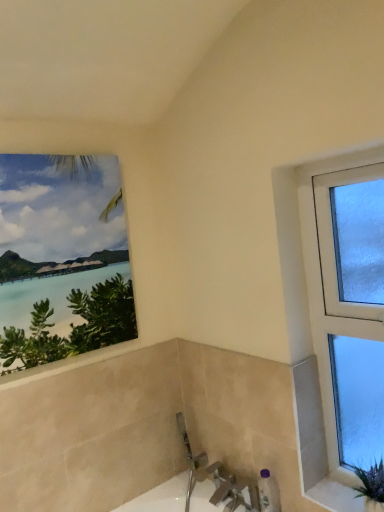
The image size is (384, 512). What do you see at coordinates (62, 258) in the screenshot?
I see `matte canvas painting at upper left, which is the first window from left to right` at bounding box center [62, 258].

This screenshot has width=384, height=512. Describe the element at coordinates (268, 492) in the screenshot. I see `purple plastic bottle at lower right` at that location.

How much space does clear glass window at right, which appears as the first window when viewed from the right, occupy vertically?

clear glass window at right, which appears as the first window when viewed from the right, is 1.16 meters tall.

Describe the element at coordinates (322, 290) in the screenshot. I see `clear glass window at right, which appears as the first window when viewed from the right` at that location.

What do you see at coordinates (338, 492) in the screenshot? I see `white textured stone at lower right` at bounding box center [338, 492].

Where is `white textured stone at lower right`? The image size is (384, 512). white textured stone at lower right is located at coordinates (338, 492).

The image size is (384, 512). What are the coordinates of `matte canvas painting at upper left, which appears as the 2th window when viewed from the right` in the screenshot? It's located at (62, 258).

Considering the sizes of white glossy bath at lower center and white textured stone at lower right in the image, is white glossy bath at lower center bigger or smaller than white textured stone at lower right?

Clearly, white glossy bath at lower center is larger in size than white textured stone at lower right.

Does white glossy bath at lower center appear on the left side of white textured stone at lower right?

Yes.

Is white glossy bath at lower center far away from white textured stone at lower right?

No, white glossy bath at lower center is in close proximity to white textured stone at lower right.

Does point (217, 467) come in front of point (312, 495)?

No, (217, 467) is further to viewer.

Is purple plastic bottle at lower right looking in the opposite direction of clear glass window at right, which is the 2th window in left-to-right order?

No, purple plastic bottle at lower right is not facing away from clear glass window at right, which is the 2th window in left-to-right order.

From the image's perspective, would you say purple plastic bottle at lower right is positioned over clear glass window at right, which is the 2th window in left-to-right order?

No, from the image's perspective, purple plastic bottle at lower right is not on top of clear glass window at right, which is the 2th window in left-to-right order.

From a real-world perspective, does purple plastic bottle at lower right sit lower than clear glass window at right, which appears as the first window when viewed from the right?

Yes, from a real-world perspective, purple plastic bottle at lower right is beneath clear glass window at right, which appears as the first window when viewed from the right.

At what (x,y) coordinates should I click in order to perform the action: click on toiletry below the clear glass window at right, which appears as the first window when viewed from the right (from a real-world perspective). Please return your answer as a coordinate pair (x, y). This screenshot has width=384, height=512. Looking at the image, I should click on (268, 492).

Is white glossy bath at lower center positioned with its back to clear glass window at right, which is the 2th window in left-to-right order?

No, clear glass window at right, which is the 2th window in left-to-right order, is not at the back of white glossy bath at lower center.

Looking at their sizes, would you say white glossy bath at lower center is wider or thinner than clear glass window at right, which is the 2th window in left-to-right order?

Considering their sizes, white glossy bath at lower center looks broader than clear glass window at right, which is the 2th window in left-to-right order.

Can you confirm if white glossy bath at lower center is bigger than clear glass window at right, which is the 2th window in left-to-right order?

Correct, white glossy bath at lower center is larger in size than clear glass window at right, which is the 2th window in left-to-right order.

Is purple plastic bottle at lower right facing away from white glossy bath at lower center?

purple plastic bottle at lower right does not have its back to white glossy bath at lower center.

Is purple plastic bottle at lower right situated inside white glossy bath at lower center or outside?

purple plastic bottle at lower right lies outside white glossy bath at lower center.

Considering the sizes of objects purple plastic bottle at lower right and white glossy bath at lower center in the image provided, who is wider, purple plastic bottle at lower right or white glossy bath at lower center?

With larger width is white glossy bath at lower center.

Which object is positioned more to the left, matte canvas painting at upper left, which appears as the 2th window when viewed from the right, or white glossy bath at lower center?

Positioned to the left is matte canvas painting at upper left, which appears as the 2th window when viewed from the right.

Considering the sizes of objects matte canvas painting at upper left, which is the first window from left to right, and white glossy bath at lower center in the image provided, who is bigger, matte canvas painting at upper left, which is the first window from left to right, or white glossy bath at lower center?

white glossy bath at lower center.

How many degrees apart are the facing directions of matte canvas painting at upper left, which is the first window from left to right, and white glossy bath at lower center?

matte canvas painting at upper left, which is the first window from left to right, and white glossy bath at lower center are facing 90 degrees away from each other.

Is matte canvas painting at upper left, which appears as the 2th window when viewed from the right, positioned beyond the bounds of white glossy bath at lower center?

Yes, matte canvas painting at upper left, which appears as the 2th window when viewed from the right, is located beyond the bounds of white glossy bath at lower center.

Is purple plastic bottle at lower right positioned behind white textured stone at lower right?

That is True.

From the image's perspective, is purple plastic bottle at lower right positioned above or below white textured stone at lower right?

purple plastic bottle at lower right is below white textured stone at lower right.

Could you tell me if purple plastic bottle at lower right is facing white textured stone at lower right?

No, purple plastic bottle at lower right is not facing towards white textured stone at lower right.

Considering the positions of objects purple plastic bottle at lower right and white textured stone at lower right in the image provided, who is more to the left, purple plastic bottle at lower right or white textured stone at lower right?

purple plastic bottle at lower right.

Based on the photo, considering the relative sizes of white textured stone at lower right and purple plastic bottle at lower right in the image provided, is white textured stone at lower right smaller than purple plastic bottle at lower right?

Yes, white textured stone at lower right is smaller than purple plastic bottle at lower right.

What's the angular difference between white textured stone at lower right and purple plastic bottle at lower right's facing directions?

The angular difference between white textured stone at lower right and purple plastic bottle at lower right is 0.000106 degrees.

Is white textured stone at lower right surrounding purple plastic bottle at lower right?

No, white textured stone at lower right does not contain purple plastic bottle at lower right.

In the image, is white textured stone at lower right on the left side or the right side of purple plastic bottle at lower right?

Clearly, white textured stone at lower right is on the right of purple plastic bottle at lower right in the image.

In order to click on window sill on the right of white glossy bath at lower center in this screenshot , I will do `click(338, 492)`.

At what (x,y) coordinates should I click in order to perform the action: click on toiletry behind the clear glass window at right, which appears as the first window when viewed from the right. Please return your answer as a coordinate pair (x, y). The height and width of the screenshot is (512, 384). Looking at the image, I should click on (268, 492).

From the image, which object appears to be farther from purple plastic bottle at lower right, white glossy bath at lower center or white textured stone at lower right?

Among the two, white glossy bath at lower center is located further to purple plastic bottle at lower right.

Estimate the real-world distances between objects in this image. Which object is closer to purple plastic bottle at lower right, clear glass window at right, which appears as the first window when viewed from the right, or white glossy bath at lower center?

white glossy bath at lower center is positioned closer to the anchor purple plastic bottle at lower right.

From the image, which object appears to be nearer to clear glass window at right, which appears as the first window when viewed from the right, white textured stone at lower right or matte canvas painting at upper left, which appears as the 2th window when viewed from the right?

Among the two, white textured stone at lower right is located nearer to clear glass window at right, which appears as the first window when viewed from the right.

Looking at the image, which one is located further to matte canvas painting at upper left, which appears as the 2th window when viewed from the right, clear glass window at right, which is the 2th window in left-to-right order, or white textured stone at lower right?

white textured stone at lower right is positioned further to the anchor matte canvas painting at upper left, which appears as the 2th window when viewed from the right.

From the image, which object appears to be nearer to white textured stone at lower right, clear glass window at right, which appears as the first window when viewed from the right, or purple plastic bottle at lower right?

The object closer to white textured stone at lower right is purple plastic bottle at lower right.

Considering their positions, is white textured stone at lower right positioned further to clear glass window at right, which is the 2th window in left-to-right order, than white glossy bath at lower center?

white glossy bath at lower center.

Which object lies further to the anchor point purple plastic bottle at lower right, matte canvas painting at upper left, which appears as the 2th window when viewed from the right, or white glossy bath at lower center?

Among the two, matte canvas painting at upper left, which appears as the 2th window when viewed from the right, is located further to purple plastic bottle at lower right.

Consider the image. Estimate the real-world distances between objects in this image. Which object is further from purple plastic bottle at lower right, matte canvas painting at upper left, which appears as the 2th window when viewed from the right, or white textured stone at lower right?

Based on the image, matte canvas painting at upper left, which appears as the 2th window when viewed from the right, appears to be further to purple plastic bottle at lower right.

Identify the location of toiletry between matte canvas painting at upper left, which is the first window from left to right, and white glossy bath at lower center vertically. This screenshot has height=512, width=384. (268, 492).

You are a GUI agent. You are given a task and a screenshot of the screen. Output one action in this format:
    pyautogui.click(x=<x>, y=<y>)
    Task: Click on the toiletry between white glossy bath at lower center and white textured stone at lower right from left to right
    This screenshot has height=512, width=384.
    Given the screenshot: What is the action you would take?
    pyautogui.click(x=268, y=492)

This screenshot has width=384, height=512. I want to click on toiletry between clear glass window at right, which is the 2th window in left-to-right order, and white glossy bath at lower center vertically, so click(268, 492).

At what (x,y) coordinates should I click in order to perform the action: click on toiletry located between matte canvas painting at upper left, which appears as the 2th window when viewed from the right, and clear glass window at right, which is the 2th window in left-to-right order, in the left-right direction. Please return your answer as a coordinate pair (x, y). The image size is (384, 512). Looking at the image, I should click on (268, 492).